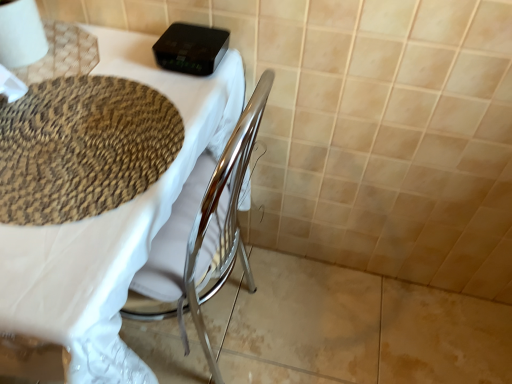
Question: From a real-world perspective, is matte woven placemat at upper left located beneath woven beige mat at upper left?

Choices:
 (A) no
 (B) yes

Answer: (B)

Question: Is matte woven placemat at upper left positioned behind woven beige mat at upper left?

Choices:
 (A) yes
 (B) no

Answer: (B)

Question: Is matte woven placemat at upper left aimed at woven beige mat at upper left?

Choices:
 (A) no
 (B) yes

Answer: (A)

Question: Would you say matte woven placemat at upper left is outside woven beige mat at upper left?

Choices:
 (A) yes
 (B) no

Answer: (A)

Question: Does matte woven placemat at upper left appear on the left side of woven beige mat at upper left?

Choices:
 (A) no
 (B) yes

Answer: (B)

Question: From the image's perspective, is matte woven placemat at upper left above woven beige mat at upper left?

Choices:
 (A) yes
 (B) no

Answer: (B)

Question: From the image's perspective, is woven beige mat at upper left beneath matte woven placemat at upper left?

Choices:
 (A) no
 (B) yes

Answer: (A)

Question: Does woven beige mat at upper left have a smaller size compared to matte woven placemat at upper left?

Choices:
 (A) yes
 (B) no

Answer: (A)

Question: From the image's perspective, would you say woven beige mat at upper left is positioned over matte woven placemat at upper left?

Choices:
 (A) yes
 (B) no

Answer: (A)

Question: Is woven beige mat at upper left far away from matte woven placemat at upper left?

Choices:
 (A) no
 (B) yes

Answer: (A)

Question: Is woven beige mat at upper left next to matte woven placemat at upper left and touching it?

Choices:
 (A) yes
 (B) no

Answer: (B)

Question: Is woven beige mat at upper left taller than matte woven placemat at upper left?

Choices:
 (A) no
 (B) yes

Answer: (A)

Question: Does matte woven placemat at upper left have a greater height compared to white paper at upper left?

Choices:
 (A) no
 (B) yes

Answer: (B)